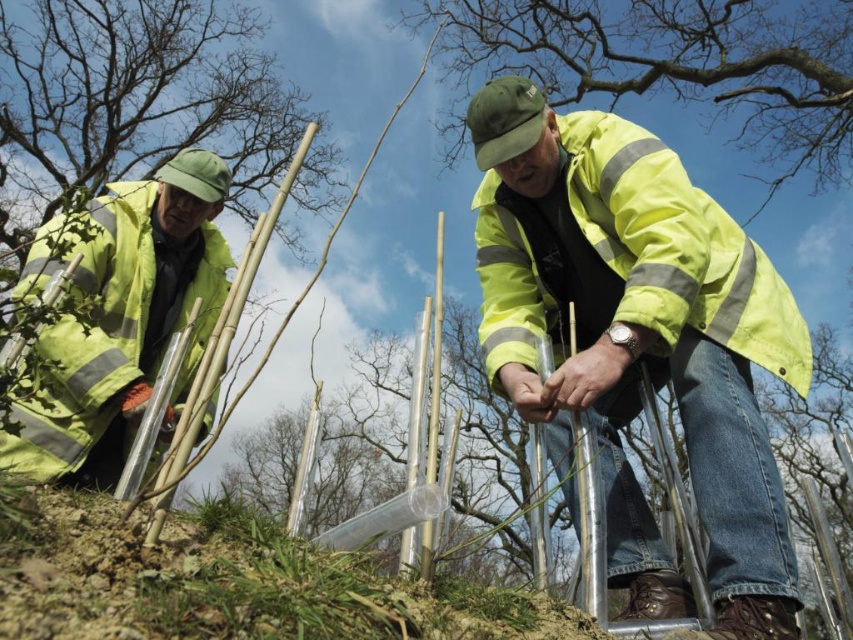
Question: Where is high-visibility yellow jacket at center located in relation to high visibility yellow jacket at left in the image?

Choices:
 (A) right
 (B) left

Answer: (A)

Question: Is high-visibility yellow jacket at center below high visibility yellow jacket at left?

Choices:
 (A) yes
 (B) no

Answer: (B)

Question: Does high-visibility yellow jacket at center have a smaller size compared to high visibility yellow jacket at left?

Choices:
 (A) yes
 (B) no

Answer: (A)

Question: Considering the real-world distances, which object is farthest from the high-visibility yellow jacket at center?

Choices:
 (A) yellow reflective jacket at center
 (B) high visibility yellow jacket at left

Answer: (A)

Question: Which is nearer to the high visibility yellow jacket at left?

Choices:
 (A) high-visibility yellow jacket at center
 (B) yellow reflective jacket at center

Answer: (A)

Question: Which of the following is the closest to the observer?

Choices:
 (A) (48, 353)
 (B) (550, 96)

Answer: (A)